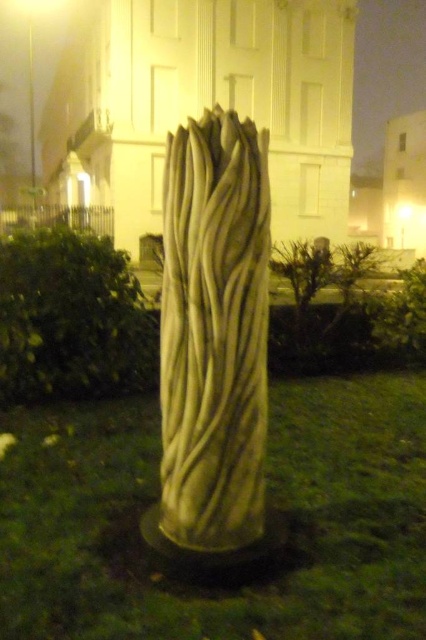
You are standing at the base of the tall sculpture in the nighttime scene. You notice a point marked at coordinates (213,333). Which object in the scene does this point belong to?

The point at coordinates (213,333) is on the white marble column at center.